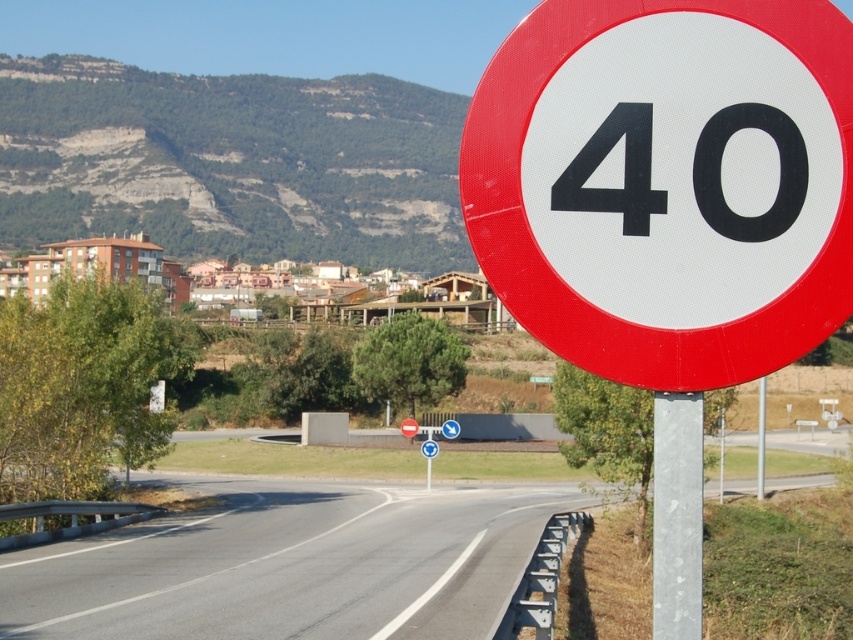
You are driving along the asphalt road at center and need to reach a destination located at coordinate point 0.884, 0.340. Is the red circular road sign with the number 40 on the right side of the road?

Yes, the red circular road sign with the number 40 is positioned on the right side of the asphalt road at center, so it is on the right side of the road.